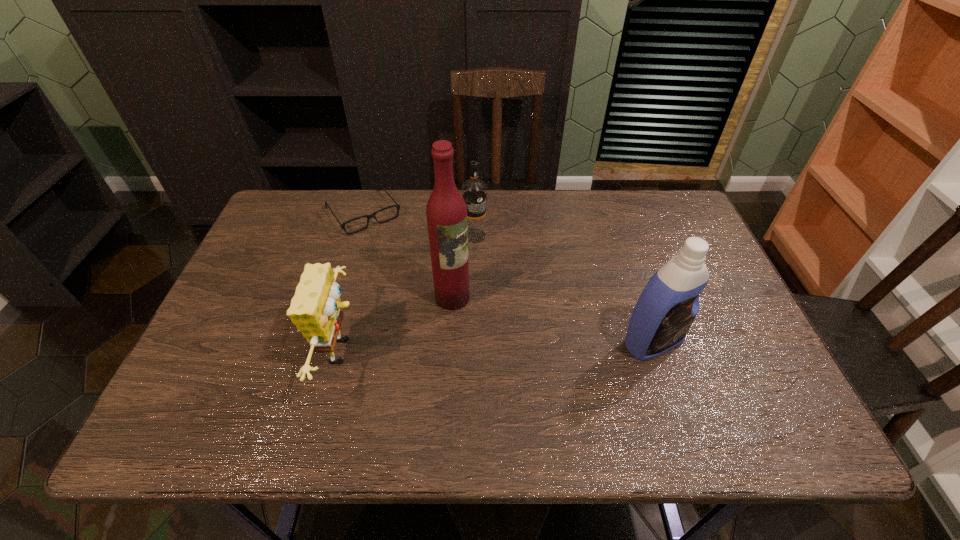
Identify the location of object located in the left edge section of the desktop. (397, 206).

Where is `object positioned at the right edge`? object positioned at the right edge is located at coordinates (668, 305).

Where is `object located at the far left corner`? This screenshot has height=540, width=960. object located at the far left corner is located at coordinates (397, 206).

Where is `free space at the far edge of the desktop`? Image resolution: width=960 pixels, height=540 pixels. free space at the far edge of the desktop is located at coordinates (334, 236).

The image size is (960, 540). In order to click on free location at the near edge in this screenshot , I will do `click(493, 375)`.

Identify the location of free space at the left edge of the desktop. The height and width of the screenshot is (540, 960). (274, 294).

You are a GUI agent. You are given a task and a screenshot of the screen. Output one action in this format:
    pyautogui.click(x=<x>, y=<y>)
    Task: Click on the free space at the right edge
    This screenshot has height=540, width=960.
    Given the screenshot: What is the action you would take?
    pyautogui.click(x=738, y=339)

Find the location of a particular element. The image size is (960, 540). vacant space at the far left corner of the desktop is located at coordinates (293, 198).

This screenshot has width=960, height=540. In the image, there is a desktop. In order to click on vacant space at the far right corner in this screenshot , I will do `click(696, 228)`.

Identify the location of vacant area that lies between the vodka and the fourth shortest object. The width and height of the screenshot is (960, 540). (564, 289).